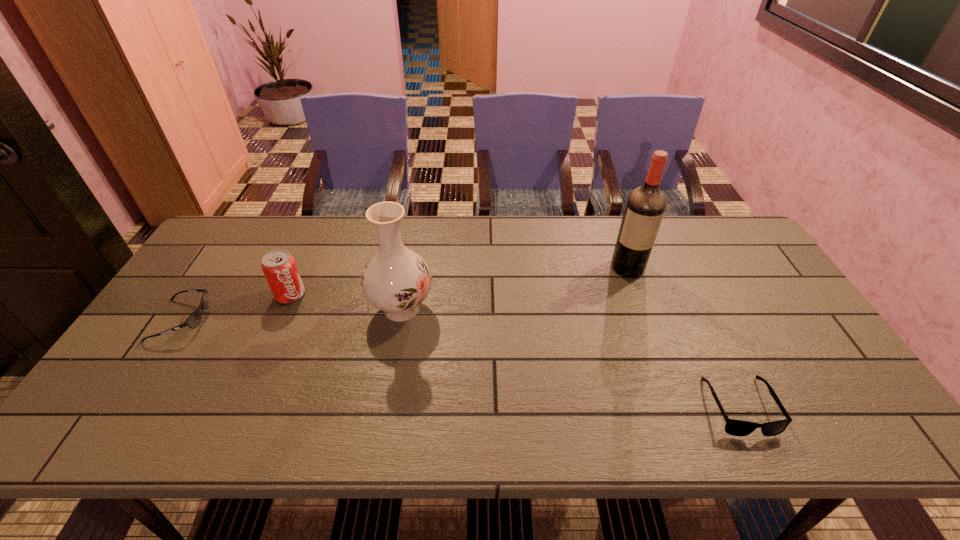
Where is `the second closest object to the left sunglasses`? The image size is (960, 540). the second closest object to the left sunglasses is located at coordinates (396, 280).